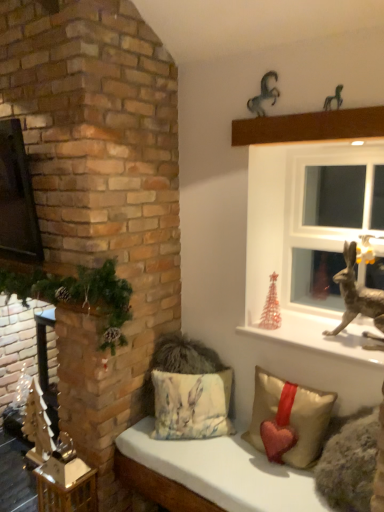
Question: Are fluffy fabric cushion at lower center and shiny metallic reindeer at right far apart?

Choices:
 (A) yes
 (B) no

Answer: (B)

Question: Is fluffy fabric cushion at lower center turned away from shiny metallic reindeer at right?

Choices:
 (A) yes
 (B) no

Answer: (B)

Question: Is fluffy fabric cushion at lower center positioned behind shiny metallic reindeer at right?

Choices:
 (A) no
 (B) yes

Answer: (A)

Question: From a real-world perspective, does fluffy fabric cushion at lower center sit lower than shiny metallic reindeer at right?

Choices:
 (A) no
 (B) yes

Answer: (B)

Question: Considering the relative sizes of fluffy fabric cushion at lower center and shiny metallic reindeer at right in the image provided, is fluffy fabric cushion at lower center taller than shiny metallic reindeer at right?

Choices:
 (A) no
 (B) yes

Answer: (B)

Question: From a real-world perspective, is fluffy fabric cushion at lower center positioned over shiny metallic reindeer at right based on gravity?

Choices:
 (A) yes
 (B) no

Answer: (B)

Question: Can you confirm if translucent glass christmas tree at right, which ranks as the first christmas decoration in right-to-left order, is smaller than fluffy fabric cushion at lower center?

Choices:
 (A) yes
 (B) no

Answer: (A)

Question: Is fluffy fabric cushion at lower center at the back of translucent glass christmas tree at right, which ranks as the first christmas decoration in right-to-left order?

Choices:
 (A) no
 (B) yes

Answer: (A)

Question: Is translucent glass christmas tree at right, which ranks as the first christmas decoration in right-to-left order, bigger than fluffy fabric cushion at lower center?

Choices:
 (A) no
 (B) yes

Answer: (A)

Question: From the image's perspective, does translucent glass christmas tree at right, which ranks as the first christmas decoration in right-to-left order, appear lower than fluffy fabric cushion at lower center?

Choices:
 (A) no
 (B) yes

Answer: (A)

Question: From a real-world perspective, is translucent glass christmas tree at right, which is the first christmas decoration from back to front, on top of fluffy fabric cushion at lower center?

Choices:
 (A) yes
 (B) no

Answer: (A)

Question: From the image's perspective, would you say translucent glass christmas tree at right, which ranks as the first christmas decoration in right-to-left order, is positioned over fluffy fabric cushion at lower center?

Choices:
 (A) yes
 (B) no

Answer: (A)

Question: Is fluffy fabric cushion at lower center beside metallic horse at upper right, the second animal from the back?

Choices:
 (A) yes
 (B) no

Answer: (B)